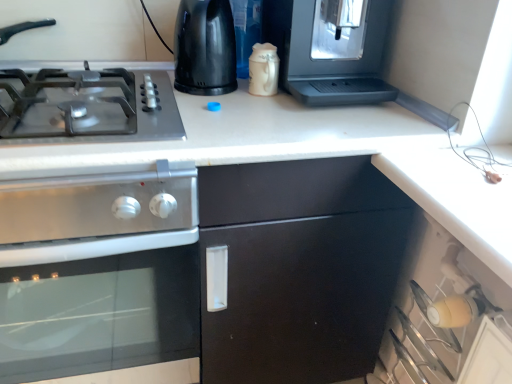
Measure the distance between point [203,3] and camera.

Point [203,3] is 92.60 centimeters away from camera.

This screenshot has height=384, width=512. What do you see at coordinates (205, 48) in the screenshot?
I see `black plastic kettle at upper center, the second appliance when ordered from right to left` at bounding box center [205, 48].

This screenshot has width=512, height=384. Identify the location of satin silver coffee machine at upper right, which is counted as the 2th appliance, starting from the left. (331, 49).

This screenshot has width=512, height=384. I want to click on stainless steel oven at left, so click(x=101, y=276).

This screenshot has width=512, height=384. Describe the element at coordinates (101, 276) in the screenshot. I see `stainless steel oven at left` at that location.

Locate an element on the screen. black plastic kettle at upper center, marked as the first appliance in a left-to-right arrangement is located at coordinates (205, 48).

From the image's perspective, between metallic gray gas stove at left and satin silver coffee machine at upper right, which is counted as the 2th appliance, starting from the left, who is located below?

metallic gray gas stove at left is shown below in the image.

Which object is positioned more to the left, metallic gray gas stove at left or satin silver coffee machine at upper right, arranged as the first appliance when viewed from the right?

metallic gray gas stove at left.

Is metallic gray gas stove at left in front of or behind satin silver coffee machine at upper right, arranged as the first appliance when viewed from the right, in the image?

metallic gray gas stove at left is positioned closer to the viewer than satin silver coffee machine at upper right, arranged as the first appliance when viewed from the right.

Is black plastic kettle at upper center, marked as the first appliance in a left-to-right arrangement, to the left of satin silver coffee machine at upper right, arranged as the first appliance when viewed from the right, from the viewer's perspective?

Yes, black plastic kettle at upper center, marked as the first appliance in a left-to-right arrangement, is to the left of satin silver coffee machine at upper right, arranged as the first appliance when viewed from the right.

From the image's perspective, between black plastic kettle at upper center, the second appliance when ordered from right to left, and satin silver coffee machine at upper right, which is counted as the 2th appliance, starting from the left, who is located below?

black plastic kettle at upper center, the second appliance when ordered from right to left, appears lower in the image.

How many degrees apart are the facing directions of black plastic kettle at upper center, marked as the first appliance in a left-to-right arrangement, and satin silver coffee machine at upper right, which is counted as the 2th appliance, starting from the left?

The angular difference between black plastic kettle at upper center, marked as the first appliance in a left-to-right arrangement, and satin silver coffee machine at upper right, which is counted as the 2th appliance, starting from the left, is 0.000303 degrees.

Based on the photo, which of these two, black plastic kettle at upper center, the second appliance when ordered from right to left, or satin silver coffee machine at upper right, which is counted as the 2th appliance, starting from the left, is smaller?

With smaller size is black plastic kettle at upper center, the second appliance when ordered from right to left.

Measure the distance between black plastic kettle at upper center, the second appliance when ordered from right to left, and stainless steel oven at left.

black plastic kettle at upper center, the second appliance when ordered from right to left, is 19.24 inches from stainless steel oven at left.

Is stainless steel oven at left completely or partially inside black plastic kettle at upper center, marked as the first appliance in a left-to-right arrangement?

No, stainless steel oven at left is not surrounded by black plastic kettle at upper center, marked as the first appliance in a left-to-right arrangement.

Considering the sizes of objects black plastic kettle at upper center, marked as the first appliance in a left-to-right arrangement, and stainless steel oven at left in the image provided, who is smaller, black plastic kettle at upper center, marked as the first appliance in a left-to-right arrangement, or stainless steel oven at left?

black plastic kettle at upper center, marked as the first appliance in a left-to-right arrangement, is smaller.

From the image's perspective, is black plastic kettle at upper center, marked as the first appliance in a left-to-right arrangement, positioned above or below stainless steel oven at left?

black plastic kettle at upper center, marked as the first appliance in a left-to-right arrangement, is above stainless steel oven at left.

From the image's perspective, is satin silver coffee machine at upper right, arranged as the first appliance when viewed from the right, above stainless steel oven at left?

Indeed, from the image's perspective, satin silver coffee machine at upper right, arranged as the first appliance when viewed from the right, is shown above stainless steel oven at left.

Considering the relative positions of satin silver coffee machine at upper right, which is counted as the 2th appliance, starting from the left, and stainless steel oven at left in the image provided, is satin silver coffee machine at upper right, which is counted as the 2th appliance, starting from the left, to the right of stainless steel oven at left from the viewer's perspective?

Yes.

From a real-world perspective, which is physically below, satin silver coffee machine at upper right, which is counted as the 2th appliance, starting from the left, or stainless steel oven at left?

stainless steel oven at left, from a real-world perspective.

Considering the sizes of objects satin silver coffee machine at upper right, which is counted as the 2th appliance, starting from the left, and stainless steel oven at left in the image provided, who is wider, satin silver coffee machine at upper right, which is counted as the 2th appliance, starting from the left, or stainless steel oven at left?

With larger width is stainless steel oven at left.

From a real-world perspective, does metallic gray gas stove at left stand above black plastic kettle at upper center, the second appliance when ordered from right to left?

No, from a real-world perspective, metallic gray gas stove at left is not on top of black plastic kettle at upper center, the second appliance when ordered from right to left.

Which appliance is the 1st one when counting from the right side of the metallic gray gas stove at left? Please provide its 2D coordinates.

[(205, 48)]

Can we say metallic gray gas stove at left lies outside black plastic kettle at upper center, marked as the first appliance in a left-to-right arrangement?

Yes, metallic gray gas stove at left is located beyond the bounds of black plastic kettle at upper center, marked as the first appliance in a left-to-right arrangement.

Is metallic gray gas stove at left far from black plastic kettle at upper center, marked as the first appliance in a left-to-right arrangement?

No.

Based on the photo, which of these two, satin silver coffee machine at upper right, arranged as the first appliance when viewed from the right, or metallic gray gas stove at left, is thinner?

With smaller width is satin silver coffee machine at upper right, arranged as the first appliance when viewed from the right.

Is satin silver coffee machine at upper right, arranged as the first appliance when viewed from the right, oriented away from metallic gray gas stove at left?

No, satin silver coffee machine at upper right, arranged as the first appliance when viewed from the right, is not facing the opposite direction of metallic gray gas stove at left.

Where is `the 2nd appliance positioned above the metallic gray gas stove at left (from a real-world perspective)`? This screenshot has width=512, height=384. the 2nd appliance positioned above the metallic gray gas stove at left (from a real-world perspective) is located at coordinates (331, 49).

Is satin silver coffee machine at upper right, which is counted as the 2th appliance, starting from the left, to the left of metallic gray gas stove at left from the viewer's perspective?

No.

In terms of width, does stainless steel oven at left look wider or thinner when compared to metallic gray gas stove at left?

Clearly, stainless steel oven at left has more width compared to metallic gray gas stove at left.

In the scene shown: What's the angular difference between stainless steel oven at left and metallic gray gas stove at left's facing directions?

The angular difference between stainless steel oven at left and metallic gray gas stove at left is 0.000149 degrees.

Is stainless steel oven at left not near metallic gray gas stove at left?

No, there isn't a large distance between stainless steel oven at left and metallic gray gas stove at left.

From a real-world perspective, is stainless steel oven at left physically below metallic gray gas stove at left?

Yes, from a real-world perspective, stainless steel oven at left is below metallic gray gas stove at left.

Find the location of a particular element. The height and width of the screenshot is (384, 512). appliance that is the 2nd one above the metallic gray gas stove at left (from a real-world perspective) is located at coordinates (331, 49).

Identify the location of appliance that appears on the right of black plastic kettle at upper center, the second appliance when ordered from right to left. (331, 49).

Based on their spatial positions, is stainless steel oven at left or metallic gray gas stove at left further from satin silver coffee machine at upper right, which is counted as the 2th appliance, starting from the left?

stainless steel oven at left is positioned further to the anchor satin silver coffee machine at upper right, which is counted as the 2th appliance, starting from the left.

Which object lies nearer to the anchor point stainless steel oven at left, satin silver coffee machine at upper right, which is counted as the 2th appliance, starting from the left, or metallic gray gas stove at left?

metallic gray gas stove at left is positioned closer to the anchor stainless steel oven at left.

From the image, which object appears to be farther from black plastic kettle at upper center, the second appliance when ordered from right to left, stainless steel oven at left or satin silver coffee machine at upper right, arranged as the first appliance when viewed from the right?

stainless steel oven at left lies further to black plastic kettle at upper center, the second appliance when ordered from right to left, than the other object.

Estimate the real-world distances between objects in this image. Which object is further from black plastic kettle at upper center, marked as the first appliance in a left-to-right arrangement, metallic gray gas stove at left or stainless steel oven at left?

stainless steel oven at left lies further to black plastic kettle at upper center, marked as the first appliance in a left-to-right arrangement, than the other object.

Estimate the real-world distances between objects in this image. Which object is closer to stainless steel oven at left, satin silver coffee machine at upper right, which is counted as the 2th appliance, starting from the left, or black plastic kettle at upper center, the second appliance when ordered from right to left?

black plastic kettle at upper center, the second appliance when ordered from right to left, is positioned closer to the anchor stainless steel oven at left.

When comparing their distances from black plastic kettle at upper center, the second appliance when ordered from right to left, does satin silver coffee machine at upper right, which is counted as the 2th appliance, starting from the left, or metallic gray gas stove at left seem closer?

metallic gray gas stove at left lies closer to black plastic kettle at upper center, the second appliance when ordered from right to left, than the other object.

Estimate the real-world distances between objects in this image. Which object is further from black plastic kettle at upper center, the second appliance when ordered from right to left, metallic gray gas stove at left or satin silver coffee machine at upper right, arranged as the first appliance when viewed from the right?

Based on the image, satin silver coffee machine at upper right, arranged as the first appliance when viewed from the right, appears to be further to black plastic kettle at upper center, the second appliance when ordered from right to left.

Estimate the real-world distances between objects in this image. Which object is further from metallic gray gas stove at left, stainless steel oven at left or satin silver coffee machine at upper right, which is counted as the 2th appliance, starting from the left?

Based on the image, satin silver coffee machine at upper right, which is counted as the 2th appliance, starting from the left, appears to be further to metallic gray gas stove at left.

Where is `appliance situated between metallic gray gas stove at left and satin silver coffee machine at upper right, which is counted as the 2th appliance, starting from the left, from left to right`? Image resolution: width=512 pixels, height=384 pixels. appliance situated between metallic gray gas stove at left and satin silver coffee machine at upper right, which is counted as the 2th appliance, starting from the left, from left to right is located at coordinates (205, 48).

I want to click on gas stove situated between stainless steel oven at left and satin silver coffee machine at upper right, arranged as the first appliance when viewed from the right, from left to right, so click(86, 106).

Image resolution: width=512 pixels, height=384 pixels. I want to click on gas stove that lies between black plastic kettle at upper center, marked as the first appliance in a left-to-right arrangement, and stainless steel oven at left from top to bottom, so click(86, 106).

Where is `appliance situated between stainless steel oven at left and satin silver coffee machine at upper right, arranged as the first appliance when viewed from the right, from left to right`? This screenshot has height=384, width=512. appliance situated between stainless steel oven at left and satin silver coffee machine at upper right, arranged as the first appliance when viewed from the right, from left to right is located at coordinates (205, 48).